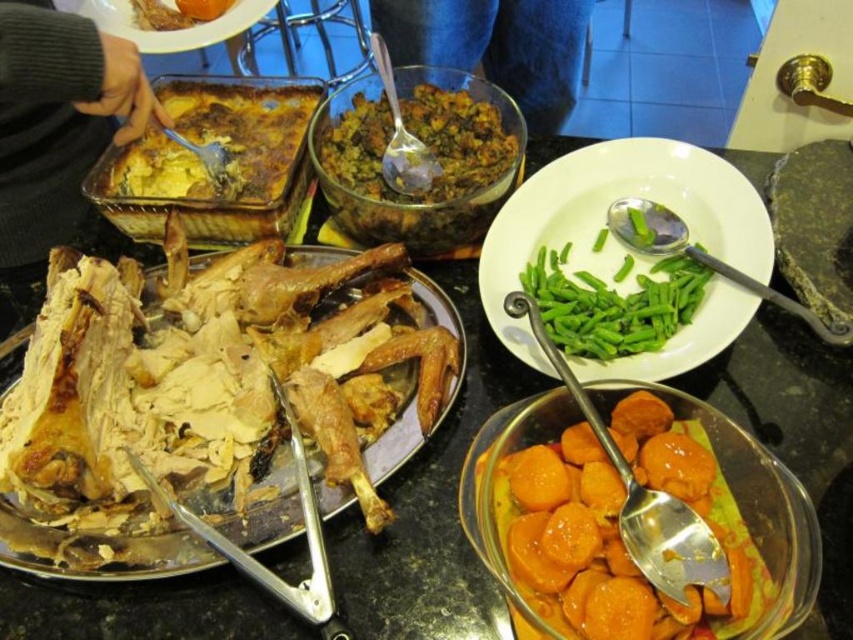
Question: Among these objects, which one is nearest to the camera?

Choices:
 (A) brown crumbly stuffing at center
 (B) orange glazed sweet potato at center
 (C) white matte plate at upper left

Answer: (B)

Question: Estimate the real-world distances between objects in this image. Which object is farther from the green matte green beans at center?

Choices:
 (A) golden brown crispy chicken at center
 (B) green smooth/soft green beans at right

Answer: (A)

Question: Estimate the real-world distances between objects in this image. Which object is closer to the orange glazed sweet potato at center?

Choices:
 (A) brown crumbly stuffing at center
 (B) golden brown crispy chicken at center
 (C) green matte green beans at center
 (D) green smooth/soft green beans at right

Answer: (D)

Question: Does golden brown crispy chicken at center have a smaller size compared to white matte plate at upper left?

Choices:
 (A) no
 (B) yes

Answer: (B)

Question: In this image, where is golden-brown baked dish at center-left located relative to green smooth/soft green beans at right?

Choices:
 (A) right
 (B) left

Answer: (B)

Question: From the image, what is the correct spatial relationship of golden brown crispy chicken at center in relation to green smooth/soft green beans at right?

Choices:
 (A) above
 (B) below

Answer: (B)